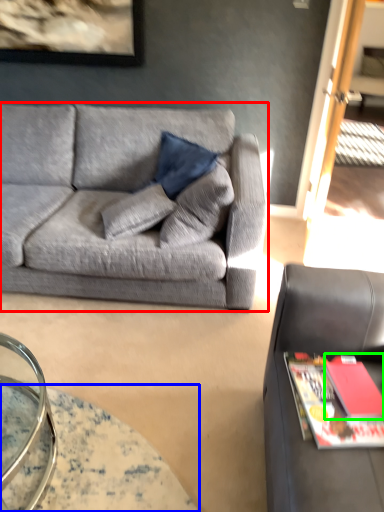
Question: Which is nearer to the studio couch (highlighted by a red box)? table (highlighted by a blue box) or book (highlighted by a green box).

Choices:
 (A) table
 (B) book

Answer: (A)